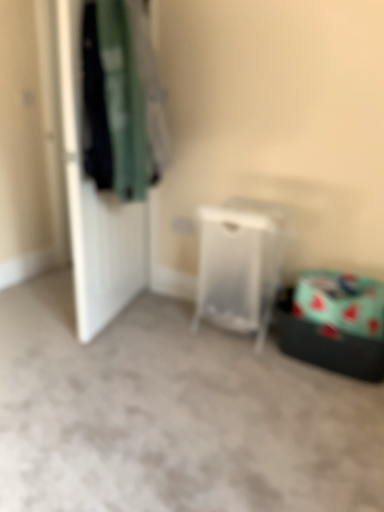
Question: Is transparent plastic laundry basket at center spatially inside dark green fabric at left, or outside of it?

Choices:
 (A) inside
 (B) outside

Answer: (B)

Question: Looking at their shapes, would you say transparent plastic laundry basket at center is wider or thinner than dark green fabric at left?

Choices:
 (A) wide
 (B) thin

Answer: (A)

Question: Based on their relative distances, which object is nearer to the transparent plastic laundry basket at center?

Choices:
 (A) dark green fabric at left
 (B) white matte door at left

Answer: (A)

Question: Estimate the real-world distances between objects in this image. Which object is closer to the transparent plastic laundry basket at center?

Choices:
 (A) white matte door at left
 (B) dark green fabric at left

Answer: (B)